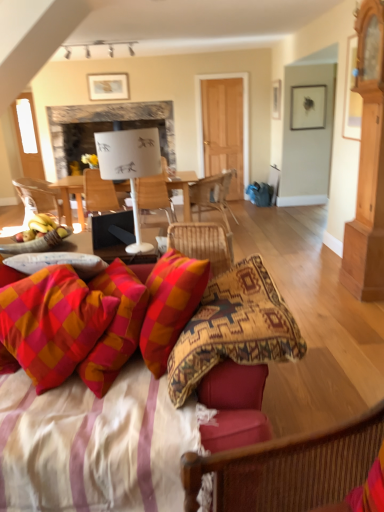
Question: Is matte black picture frame at upper right, which ranks as the first picture frame in front-to-back order, closer to camera compared to plaid fabric pillow at lower left?

Choices:
 (A) no
 (B) yes

Answer: (A)

Question: Is matte black picture frame at upper right, which ranks as the first picture frame in front-to-back order, touching plaid fabric pillow at lower left?

Choices:
 (A) yes
 (B) no

Answer: (B)

Question: From the image's perspective, is matte black picture frame at upper right, the 2th picture frame positioned from the left, over plaid fabric pillow at lower left?

Choices:
 (A) yes
 (B) no

Answer: (A)

Question: Considering the relative sizes of matte black picture frame at upper right, acting as the first picture frame starting from the bottom, and plaid fabric pillow at lower left in the image provided, is matte black picture frame at upper right, acting as the first picture frame starting from the bottom, thinner than plaid fabric pillow at lower left?

Choices:
 (A) no
 (B) yes

Answer: (B)

Question: Considering the relative positions of matte black picture frame at upper right, acting as the first picture frame starting from the bottom, and plaid fabric pillow at lower left in the image provided, is matte black picture frame at upper right, acting as the first picture frame starting from the bottom, behind plaid fabric pillow at lower left?

Choices:
 (A) no
 (B) yes

Answer: (B)

Question: From a real-world perspective, is matte black picture frame at upper right, the second picture frame in the back-to-front sequence, positioned under plaid fabric pillow at lower left based on gravity?

Choices:
 (A) no
 (B) yes

Answer: (A)

Question: From the image's perspective, is textured fabric couch at lower center above plaid fabric pillow at lower left?

Choices:
 (A) yes
 (B) no

Answer: (B)

Question: Does textured fabric couch at lower center have a lesser height compared to plaid fabric pillow at lower left?

Choices:
 (A) no
 (B) yes

Answer: (A)

Question: Is textured fabric couch at lower center next to plaid fabric pillow at lower left and touching it?

Choices:
 (A) no
 (B) yes

Answer: (A)

Question: Considering the relative sizes of textured fabric couch at lower center and plaid fabric pillow at lower left in the image provided, is textured fabric couch at lower center wider than plaid fabric pillow at lower left?

Choices:
 (A) no
 (B) yes

Answer: (B)

Question: Does textured fabric couch at lower center come behind plaid fabric pillow at lower left?

Choices:
 (A) yes
 (B) no

Answer: (B)

Question: Is textured fabric couch at lower center oriented away from plaid fabric pillow at lower left?

Choices:
 (A) yes
 (B) no

Answer: (A)

Question: Does white paperboard at center come behind woven wood chair at center, which is the first chair from back to front?

Choices:
 (A) no
 (B) yes

Answer: (B)